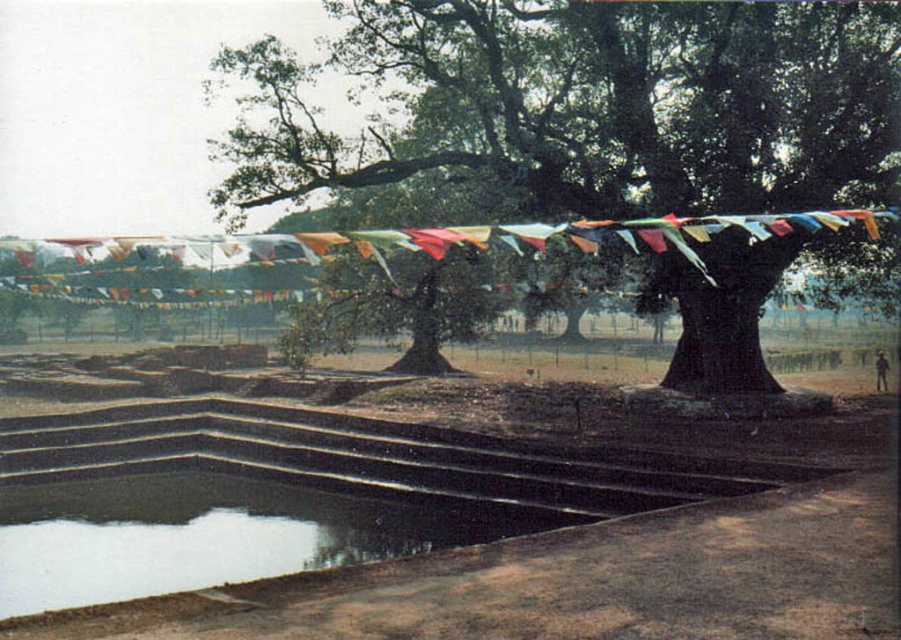
Is brown earthy dirt field at center to the left of clear water at bottom left from the viewer's perspective?

In fact, brown earthy dirt field at center is to the right of clear water at bottom left.

Locate an element on the screen. Image resolution: width=901 pixels, height=640 pixels. brown earthy dirt field at center is located at coordinates (435, 518).

Based on the photo, can you confirm if brown earthy dirt field at center is smaller than green leafy tree at center?

Yes, brown earthy dirt field at center is smaller than green leafy tree at center.

Can you confirm if brown earthy dirt field at center is positioned below green leafy tree at center?

Correct, brown earthy dirt field at center is located below green leafy tree at center.

Image resolution: width=901 pixels, height=640 pixels. What do you see at coordinates (435, 518) in the screenshot? I see `brown earthy dirt field at center` at bounding box center [435, 518].

The height and width of the screenshot is (640, 901). I want to click on brown earthy dirt field at center, so click(x=435, y=518).

Find the location of a particular element. This screenshot has height=640, width=901. green leafy tree at center is located at coordinates (593, 104).

Is point (350, 176) less distant than point (225, 561)?

No, it is not.

This screenshot has width=901, height=640. Describe the element at coordinates (593, 104) in the screenshot. I see `green leafy tree at center` at that location.

Identify the location of green leafy tree at center. This screenshot has height=640, width=901. (593, 104).